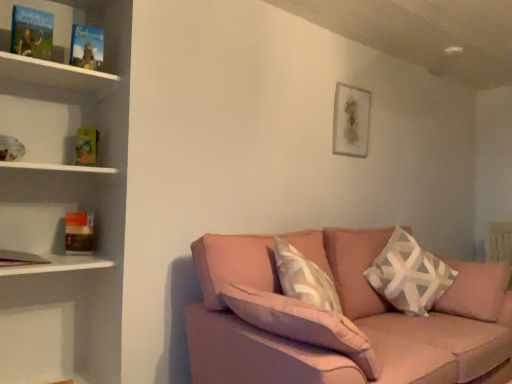
Question: Is hardcover book at left, the 4th paperback book positioned from the top, spatially inside white geometric-patterned pillow at right, or outside of it?

Choices:
 (A) inside
 (B) outside

Answer: (B)

Question: From the image's perspective, is hardcover book at left, arranged as the third paperback book when viewed from the front, located above or below white geometric-patterned pillow at right?

Choices:
 (A) above
 (B) below

Answer: (A)

Question: Which is nearer to the hardcover book at upper left, the 3th paperback book viewed from the back?

Choices:
 (A) hardcover book at left, arranged as the third paperback book when viewed from the front
 (B) wooden frame at upper center
 (C) pink fabric couch at lower right
 (D) white geometric-patterned pillow at right
 (E) hardcover book at upper left, placed as the 1th paperback book when sorted from top to bottom

Answer: (E)

Question: Estimate the real-world distances between objects in this image. Which object is closer to the white wooden shelf at left?

Choices:
 (A) white geometric-patterned pillow at right
 (B) yellow paper at left, which is counted as the third paperback book, starting from the top
 (C) hardcover book at upper left, which appears as the 2th paperback book when viewed from the top
 (D) hardcover book at upper left, positioned as the fourth paperback book in back-to-front order
 (E) wooden frame at upper center

Answer: (B)